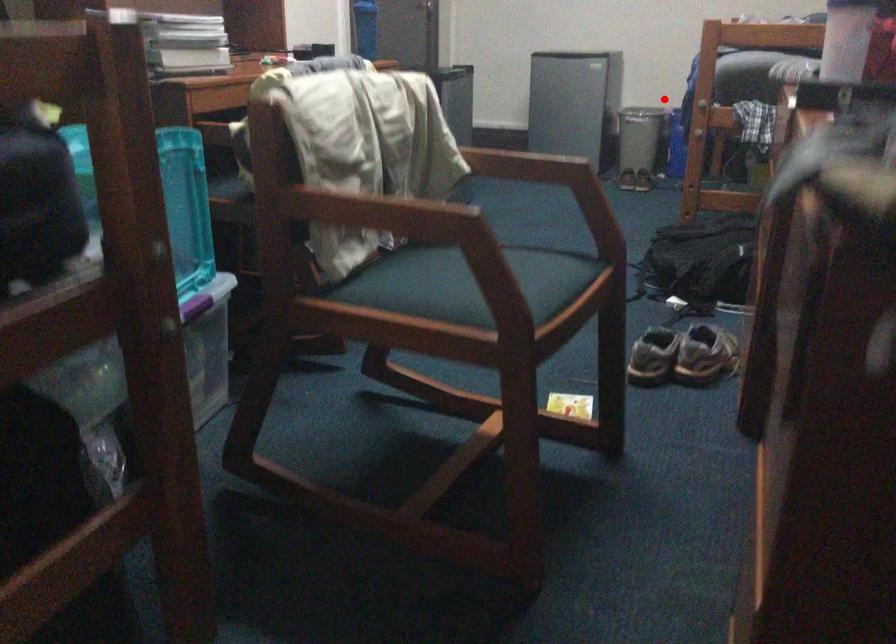
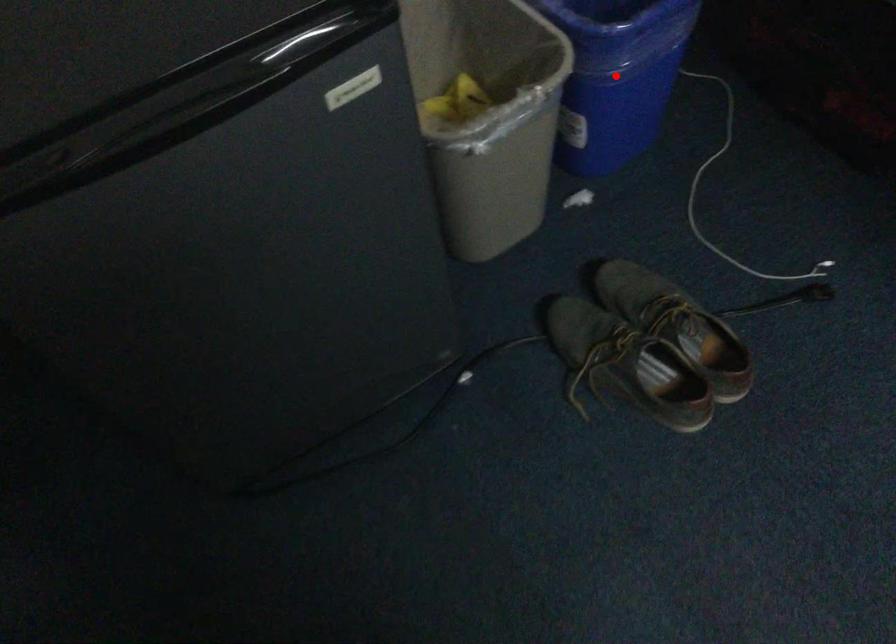
I am providing you with two images of the same scene from different viewpoints. A red point is marked on the first image and another point is marked on the second image. Does the point marked in image1 correspond to the same location as the one in image2?

Yes